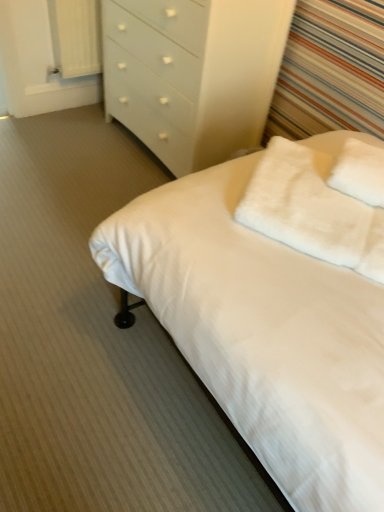
Question: From a real-world perspective, is white glossy chest of drawers at upper center physically above white soft bed at center?

Choices:
 (A) yes
 (B) no

Answer: (A)

Question: Considering the relative sizes of white glossy chest of drawers at upper center and white soft bed at center in the image provided, is white glossy chest of drawers at upper center taller than white soft bed at center?

Choices:
 (A) yes
 (B) no

Answer: (A)

Question: Considering the relative sizes of white glossy chest of drawers at upper center and white soft bed at center in the image provided, is white glossy chest of drawers at upper center bigger than white soft bed at center?

Choices:
 (A) no
 (B) yes

Answer: (B)

Question: From the image's perspective, is white glossy chest of drawers at upper center above white soft bed at center?

Choices:
 (A) yes
 (B) no

Answer: (A)

Question: Is white glossy chest of drawers at upper center wider than white soft bed at center?

Choices:
 (A) yes
 (B) no

Answer: (B)

Question: Is the position of white glossy chest of drawers at upper center less distant than that of white soft bed at center?

Choices:
 (A) no
 (B) yes

Answer: (A)

Question: From the image's perspective, would you say white soft bed at center is positioned over white fabric curtain at upper left?

Choices:
 (A) no
 (B) yes

Answer: (A)

Question: Can you confirm if white soft bed at center is wider than white fabric curtain at upper left?

Choices:
 (A) no
 (B) yes

Answer: (B)

Question: Is white soft bed at center next to white fabric curtain at upper left and touching it?

Choices:
 (A) no
 (B) yes

Answer: (A)

Question: Can you confirm if white soft bed at center is positioned to the right of white fabric curtain at upper left?

Choices:
 (A) yes
 (B) no

Answer: (A)

Question: From a real-world perspective, is white soft bed at center beneath white fabric curtain at upper left?

Choices:
 (A) yes
 (B) no

Answer: (A)

Question: Can you confirm if white soft bed at center is taller than white fabric curtain at upper left?

Choices:
 (A) no
 (B) yes

Answer: (A)

Question: Does white fabric curtain at upper left have a greater width compared to white glossy chest of drawers at upper center?

Choices:
 (A) no
 (B) yes

Answer: (A)